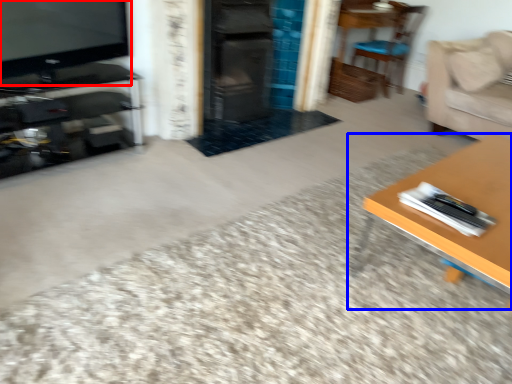
Question: Which object is further to the camera taking this photo, television (highlighted by a red box) or table (highlighted by a blue box)?

Choices:
 (A) television
 (B) table

Answer: (A)